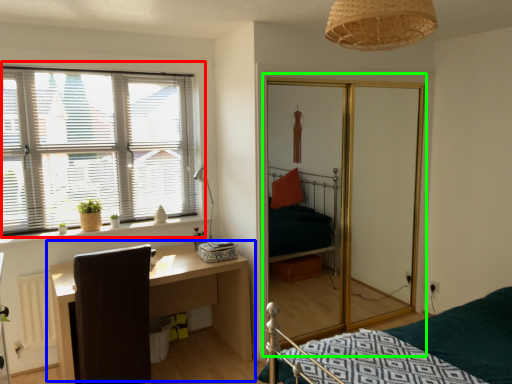
Question: Estimate the real-world distances between objects in this image. Which object is closer to window (highlighted by a red box), table (highlighted by a blue box) or screen door (highlighted by a green box)?

Choices:
 (A) table
 (B) screen door

Answer: (A)